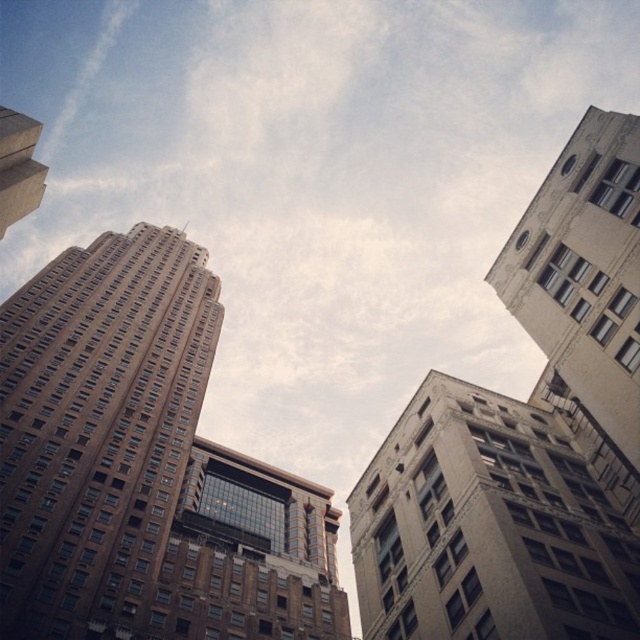
You are standing in the middle of the street looking up at the buildings. There are two points marked on the buildings. Which point is closer to you, the point at coordinates point [42,576] or point [29,157]?

Point [42,576] is closer to you because it is further to the viewer than point [29,157].

You are standing at the base of the two buildings, brown brick building at center and gray concrete building at center. Which building would require you to take more steps to walk around its front side?

The brown brick building at center might be wider than gray concrete building at center, so it would require more steps to walk around its front side.

You are standing on the street below and looking up at the two buildings. Which building is positioned higher in the sky between the brown brick building at center and the matte brown building at upper left?

The matte brown building at upper left is positioned higher in the sky than the brown brick building at center.